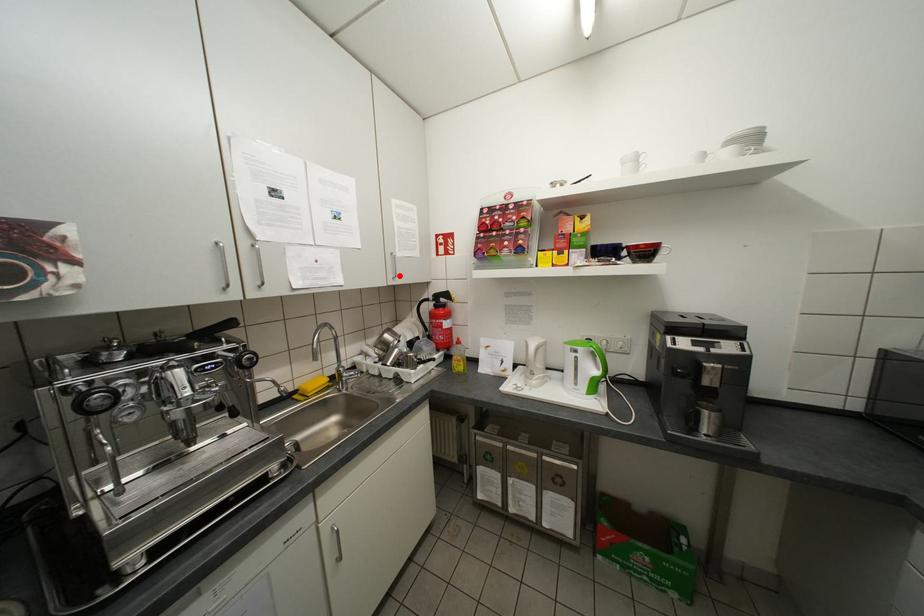
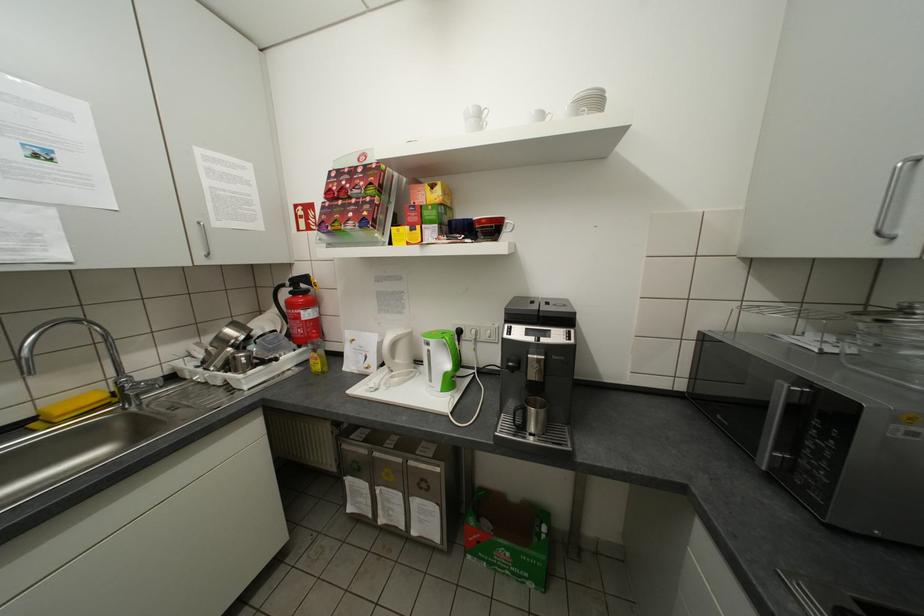
Question: I am providing you with two images of the same scene from different viewpoints. A red point is marked on the first image. At the location where the point appears in image 1, is it still visible in image 2?

Choices:
 (A) Yes
 (B) No

Answer: (A)